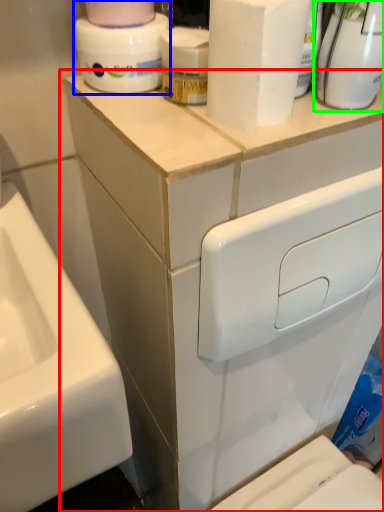
Question: Which object is the closest to the bathroom cabinet (highlighted by a red box)? Choose among these: cleaning product (highlighted by a blue box) or cleaning product (highlighted by a green box).

Choices:
 (A) cleaning product
 (B) cleaning product

Answer: (A)